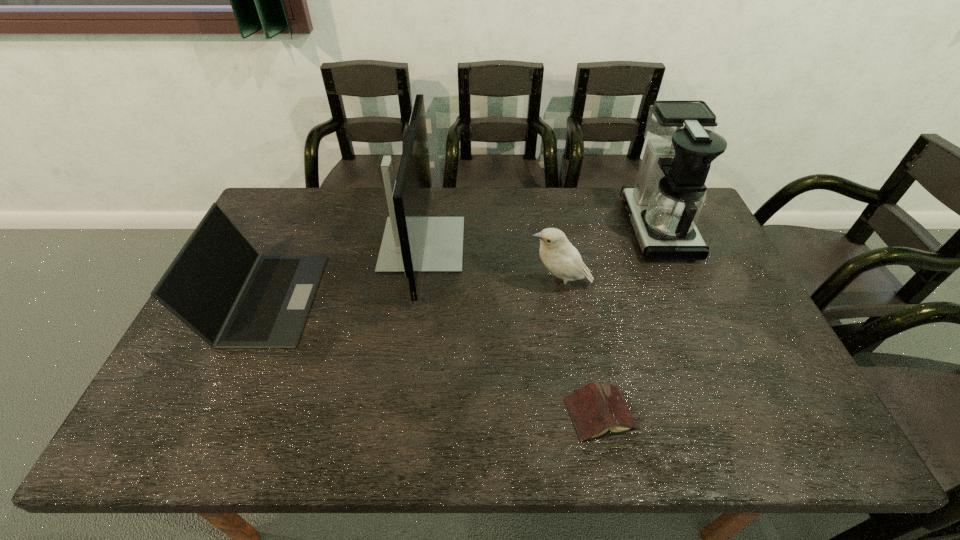
Identify the location of object situated at the far right corner. pyautogui.click(x=664, y=205).

Identify the location of vacant space at the far edge of the desktop. (534, 214).

The image size is (960, 540). I want to click on vacant space at the near edge, so click(x=404, y=445).

Where is `free region at the left edge`? This screenshot has height=540, width=960. free region at the left edge is located at coordinates (224, 411).

Find the location of a particular element. This screenshot has height=540, width=960. free space at the right edge of the desktop is located at coordinates (715, 271).

This screenshot has height=540, width=960. Find the location of `vacant area between the rightmost object and the bird`. vacant area between the rightmost object and the bird is located at coordinates (608, 256).

In order to click on free space that is in between the rightmost object and the book in this screenshot , I will do `click(629, 321)`.

Locate an element on the screen. empty location between the computer monitor and the book is located at coordinates (512, 329).

This screenshot has height=540, width=960. Find the location of `vacant point located between the computer monitor and the bird`. vacant point located between the computer monitor and the bird is located at coordinates (491, 265).

Image resolution: width=960 pixels, height=540 pixels. I want to click on vacant space that's between the nearest object and the coffee maker, so click(x=629, y=321).